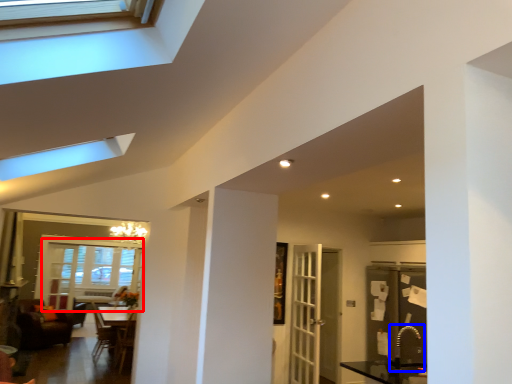
Question: Which object is further to the camera taking this photo, window (highlighted by a red box) or sink (highlighted by a blue box)?

Choices:
 (A) window
 (B) sink

Answer: (A)